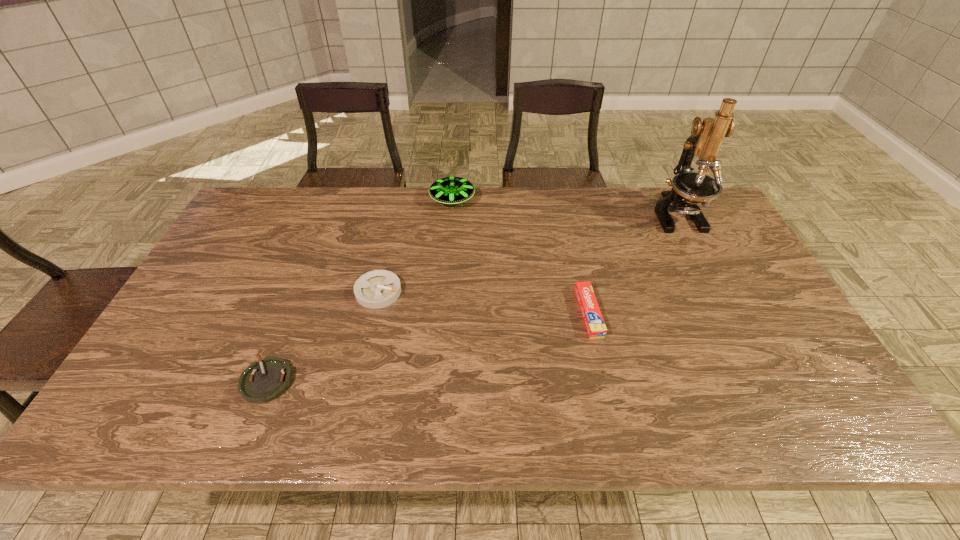
What are the coordinates of `free location at the near edge of the desktop` in the screenshot? It's located at (438, 406).

In the image, there is a desktop. Identify the location of vacant space at the left edge. (256, 280).

The height and width of the screenshot is (540, 960). What are the coordinates of `vacant space at the right edge of the desktop` in the screenshot? It's located at (766, 366).

The height and width of the screenshot is (540, 960). In order to click on vacant space in between the rightmost object and the leftmost object in this screenshot , I will do `click(472, 298)`.

I want to click on blank region between the second object from right to left and the microscope, so click(x=633, y=264).

Locate an element on the screen. This screenshot has width=960, height=540. free space between the toothpaste and the nearest object is located at coordinates (428, 347).

Find the location of a particular element. The width and height of the screenshot is (960, 540). free space between the toothpaste and the tallest object is located at coordinates (633, 264).

You are a GUI agent. You are given a task and a screenshot of the screen. Output one action in this format:
    pyautogui.click(x=<x>, y=<y>)
    Task: Click on the empty location between the right ashtray and the nearest object
    Image resolution: width=960 pixels, height=540 pixels.
    Given the screenshot: What is the action you would take?
    pyautogui.click(x=323, y=336)

This screenshot has height=540, width=960. In order to click on vacant region between the taller ashtray and the tallest object in this screenshot , I will do `click(528, 253)`.

Find the location of a particular element. This screenshot has width=960, height=540. free spot between the toothpaste and the left ashtray is located at coordinates (428, 347).